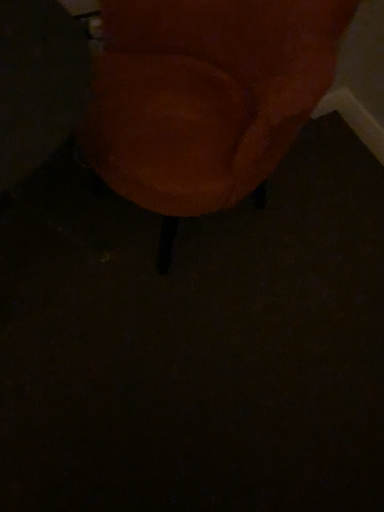
Measure the distance between point (181, 170) and camera.

Point (181, 170) and camera are 35.91 inches apart from each other.

The height and width of the screenshot is (512, 384). Find the location of `orange fabric chair at center`. orange fabric chair at center is located at coordinates (205, 97).

What is the approximate width of orange fabric chair at center?

The width of orange fabric chair at center is 59.63 centimeters.

Image resolution: width=384 pixels, height=512 pixels. What do you see at coordinates (205, 97) in the screenshot? I see `orange fabric chair at center` at bounding box center [205, 97].

Identify the location of orange fabric chair at center. (205, 97).